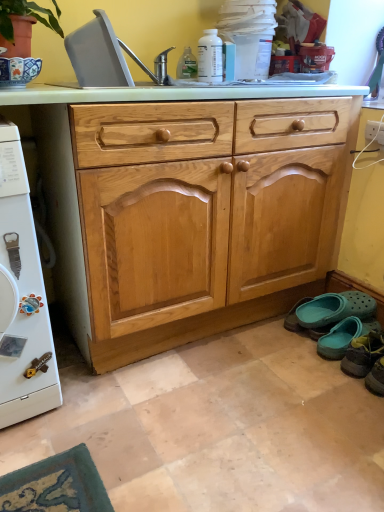
Question: From a real-world perspective, is light wood drawer at center below gray plastic sink at upper left?

Choices:
 (A) yes
 (B) no

Answer: (A)

Question: Considering the relative positions of light wood drawer at center and gray plastic sink at upper left in the image provided, is light wood drawer at center to the left of gray plastic sink at upper left from the viewer's perspective?

Choices:
 (A) yes
 (B) no

Answer: (B)

Question: Is light wood drawer at center completely or partially outside of gray plastic sink at upper left?

Choices:
 (A) no
 (B) yes

Answer: (B)

Question: Does light wood drawer at center have a greater height compared to gray plastic sink at upper left?

Choices:
 (A) no
 (B) yes

Answer: (A)

Question: Is gray plastic sink at upper left a part of light wood drawer at center?

Choices:
 (A) yes
 (B) no

Answer: (B)

Question: Does point (344, 365) appear closer or farther from the camera than point (76, 38)?

Choices:
 (A) closer
 (B) farther

Answer: (B)

Question: Based on their positions, is teal fabric slipper at lower right, which is the 1th footwear in front-to-back order, located to the left or right of gray plastic sink at upper left?

Choices:
 (A) right
 (B) left

Answer: (A)

Question: From the image's perspective, is teal fabric slipper at lower right, positioned as the 2th footwear in back-to-front order, above or below gray plastic sink at upper left?

Choices:
 (A) below
 (B) above

Answer: (A)

Question: From a real-world perspective, is teal fabric slipper at lower right, positioned as the 2th footwear in back-to-front order, above or below gray plastic sink at upper left?

Choices:
 (A) above
 (B) below

Answer: (B)

Question: Does point (170, 83) appear closer or farther from the camera than point (362, 335)?

Choices:
 (A) closer
 (B) farther

Answer: (B)

Question: In terms of width, does gray plastic sink at upper left look wider or thinner when compared to teal fabric slipper at lower right, which is the 1th footwear in front-to-back order?

Choices:
 (A) thin
 (B) wide

Answer: (B)

Question: Would you say gray plastic sink at upper left is to the left or to the right of teal fabric slipper at lower right, positioned as the 2th footwear in back-to-front order, in the picture?

Choices:
 (A) right
 (B) left

Answer: (B)

Question: From the image's perspective, is gray plastic sink at upper left above or below teal fabric slipper at lower right, positioned as the 2th footwear in back-to-front order?

Choices:
 (A) above
 (B) below

Answer: (A)

Question: Visually, is teal rubber clogs at lower right, which is the 2th footwear from front to back, positioned to the left or to the right of gray plastic sink at upper left?

Choices:
 (A) left
 (B) right

Answer: (B)

Question: From the image's perspective, is teal rubber clogs at lower right, which is the 2th footwear from front to back, located above or below gray plastic sink at upper left?

Choices:
 (A) above
 (B) below

Answer: (B)